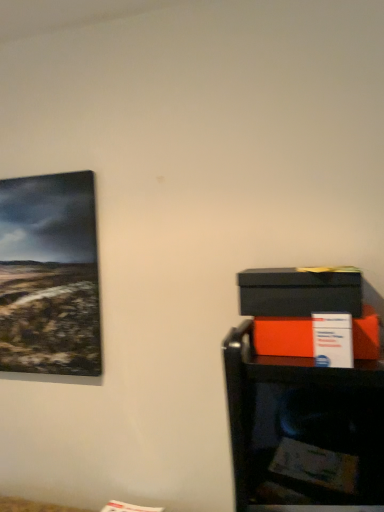
Question: Is matte black box at right, which is the 2th box from bottom to top, to the left or to the right of matte orange box at right, which is the first box in bottom-to-top order, in the image?

Choices:
 (A) left
 (B) right

Answer: (A)

Question: From a real-world perspective, is matte black box at right, marked as the first box in a top-to-bottom arrangement, physically located above or below matte orange box at right, which is the first box in bottom-to-top order?

Choices:
 (A) below
 (B) above

Answer: (B)

Question: Estimate the real-world distances between objects in this image. Which object is farther from the matte black cabinet at lower right?

Choices:
 (A) matte black box at right, which is the 2th box from bottom to top
 (B) matte orange box at right, which is the first box in bottom-to-top order

Answer: (A)

Question: Which is nearer to the matte orange box at right, arranged as the 2th box when viewed from the top?

Choices:
 (A) matte black cabinet at lower right
 (B) matte black box at right, which is the 2th box from bottom to top

Answer: (B)